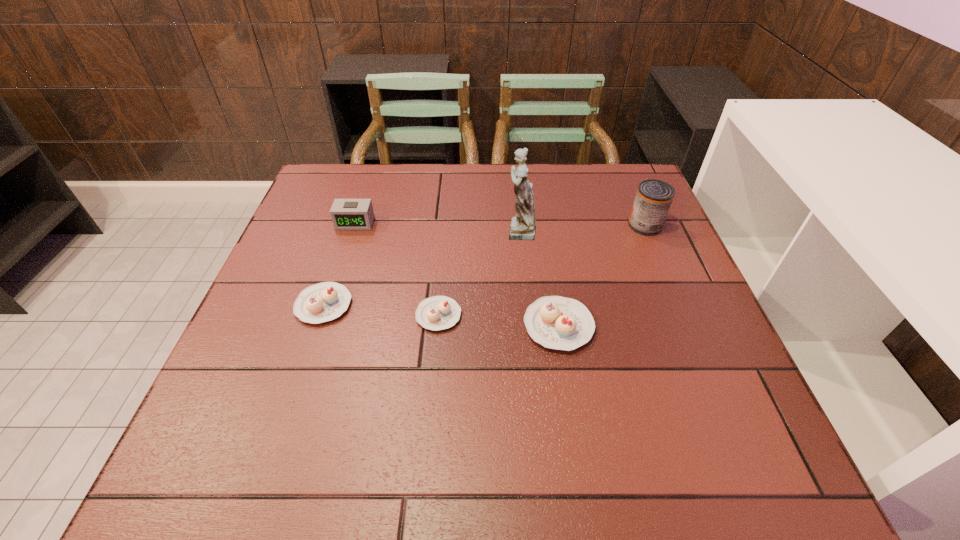
This screenshot has width=960, height=540. In order to click on vacant point located 0.190m on the front of the fourth object from right to left in this screenshot , I will do `click(430, 417)`.

I want to click on vacant space located 0.220m on the left of the rightmost cupcake, so click(x=420, y=326).

Image resolution: width=960 pixels, height=540 pixels. What are the coordinates of `vacant space located 0.390m on the front-facing side of the alarm clock` in the screenshot? It's located at (314, 352).

The width and height of the screenshot is (960, 540). What are the coordinates of `blank space located 0.120m on the front-facing side of the tallest object` in the screenshot? It's located at (454, 231).

Identify the location of vacant space situated 0.290m on the front-facing side of the tallest object. (390, 231).

The height and width of the screenshot is (540, 960). In order to click on vacant point located on the front-facing side of the tallest object in this screenshot , I will do `click(423, 231)`.

Where is `blank space located on the back of the rightmost object`? The image size is (960, 540). blank space located on the back of the rightmost object is located at coordinates (621, 169).

The width and height of the screenshot is (960, 540). Find the location of `cupcake present at the left edge`. cupcake present at the left edge is located at coordinates (326, 301).

Find the location of a particular element. alarm clock that is at the left edge is located at coordinates (347, 214).

Find the location of a particular element. This screenshot has height=540, width=960. object present at the right edge is located at coordinates (653, 199).